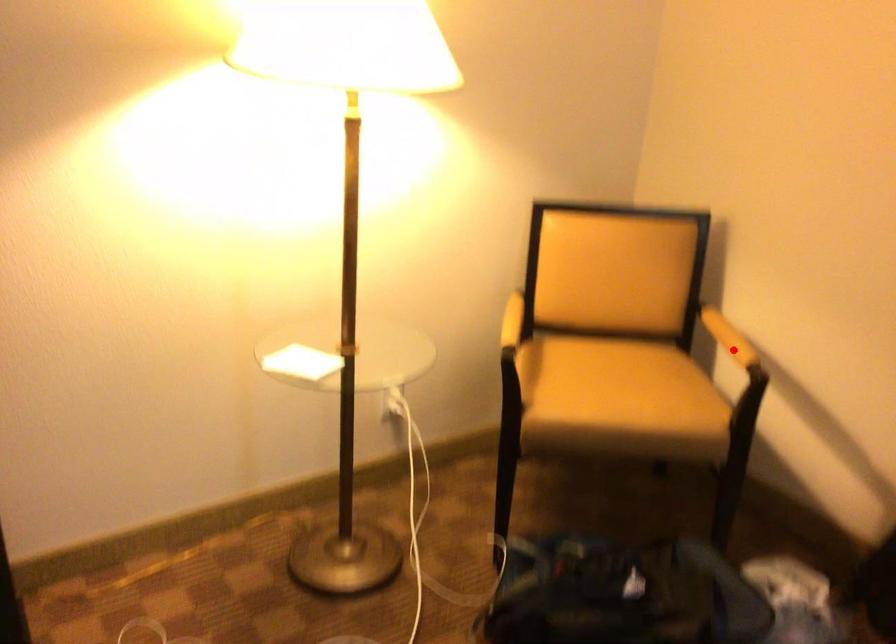
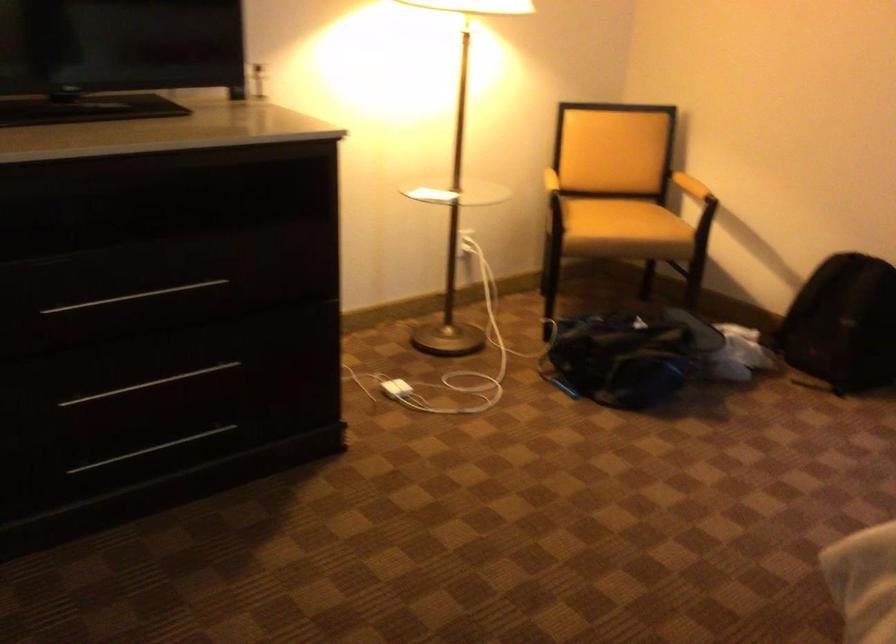
Locate, in the second image, the point that corresponds to the highlighted location in the first image.

(690, 185)